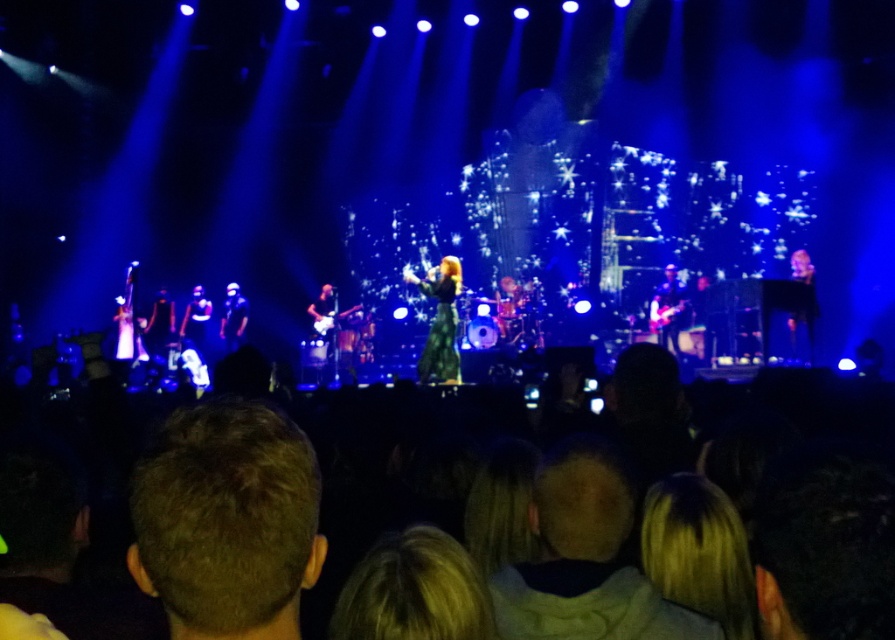
You are a photographer at the concert and want to capture a closeup shot of the lead singer. You notice a point at coordinates point (797, 276) in the image. If the distance from the camera to that point is 63.06 meters, will you be able to focus on the lead singer clearly?

The distance from the camera to point (797, 276) is 63.06 meters. Since the lead singer is likely positioned at the center of the stage, which is where the central figure is standing, and given that the point in question is at (797, 276) coordinates, it might not be the exact location of the lead singer. However, if the lead singer is at that point, the camera can focus on them at that distance. But the question is about focusing on the lead singer, not the point. Since the lead singer is in the middle,

You are at the concert and want to take a photo of the stage. You notice two points on the stage marked as point 1 and point 2. Point 1 is at coordinates [444,339] and point 2 is at [812,323]. If you want to focus on the part of the stage that is closer to you, which point should you aim your camera at?

Point 1 is closer to the viewer than point 2, so you should aim your camera at point 1 to focus on the closer part of the stage.

You are a photographer at the concert and want to capture a photo of both the green textured dress at center and the shiny black dress at right. Which dress should you focus on first if you want to include both in your frame without moving the camera?

The green textured dress at center is positioned on the left side of the shiny black dress at right, so you should focus on the green textured dress at center first to ensure both are included in the frame.